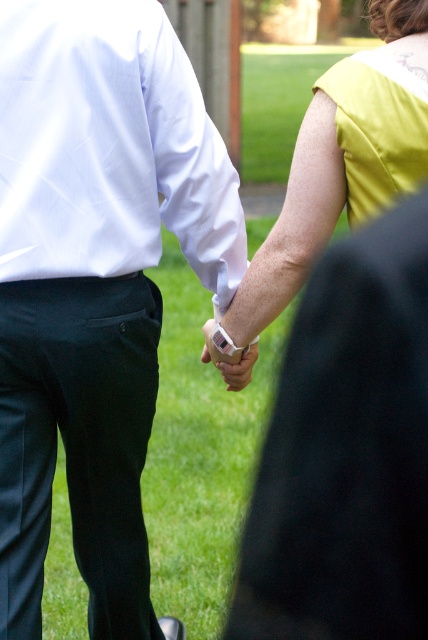
You are a photographer trying to capture the hands of the two individuals in the image. Since the yellow matte dress at center and the white matte wristband at center are both at the center, which one might block the view of the other when focusing on the hands?

The yellow matte dress at center is in front of the white matte wristband at center, so it might block the view of the white matte wristband at center when focusing on the hands.

You are a photographer adjusting your camera settings to focus on the white matte shirt at center. The camera has a focus point at coordinates point (95, 282). Is the focus point correctly placed to capture the white matte shirt at center?

Yes, the focus point at point (95, 282) is correctly placed to capture the white matte shirt at center because the Objects Description states that the point indicates the white matte shirt at center.